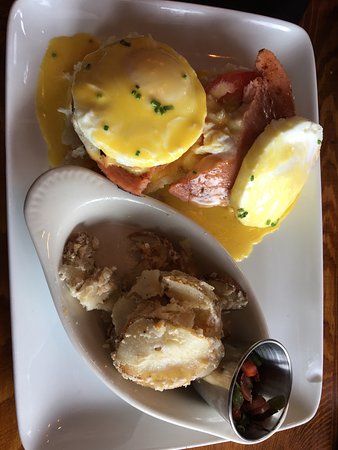
Image resolution: width=338 pixels, height=450 pixels. I want to click on plates, so click(40, 370), click(281, 294), click(59, 26).